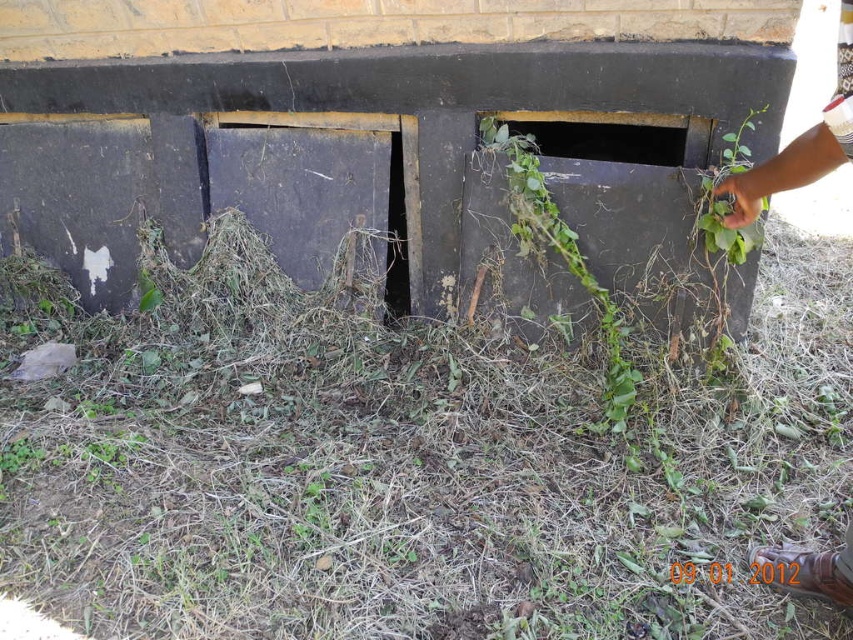
Question: Which object is the farthest from the green leafy plant at upper right?

Choices:
 (A) green leafy hole at center
 (B) green leafy hand at right
 (C) green grassy hay at lower center

Answer: (C)

Question: Which point is farther from the camera taking this photo?

Choices:
 (A) (631, 400)
 (B) (672, 164)
 (C) (254, 497)
 (D) (751, 129)

Answer: (B)

Question: From the image, what is the correct spatial relationship of green grassy hay at lower center in relation to green leafy hole at center?

Choices:
 (A) above
 (B) below

Answer: (B)

Question: Does green grassy hay at lower center have a smaller size compared to green leafy hand at right?

Choices:
 (A) no
 (B) yes

Answer: (A)

Question: Which point is closer to the camera?

Choices:
 (A) green grassy hay at lower center
 (B) green leafy hole at center
 (C) green leafy plant at upper right

Answer: (A)

Question: Is green leafy hand at right smaller than green leafy hole at center?

Choices:
 (A) no
 (B) yes

Answer: (A)